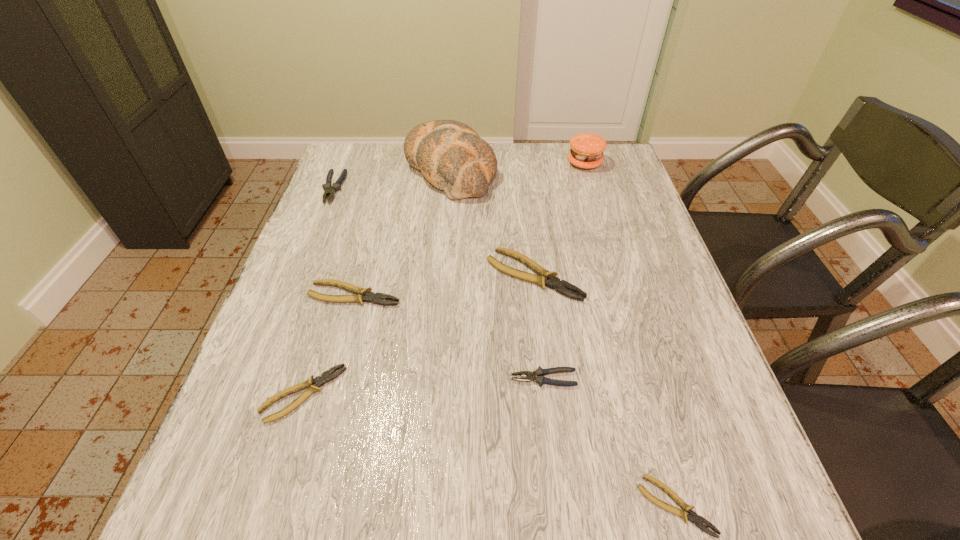
This screenshot has height=540, width=960. I want to click on the smallest yellow pliers, so click(693, 517).

Where is `the shortest object`? the shortest object is located at coordinates (693, 517).

The height and width of the screenshot is (540, 960). What are the coordinates of `vacant space situated on the left of the bread` in the screenshot? It's located at (362, 170).

Locate an element on the screen. vacant space located on the left of the patty is located at coordinates (493, 163).

I want to click on free space located 0.300m at the gripping part of the farther gray pliers, so click(x=296, y=284).

Image resolution: width=960 pixels, height=540 pixels. Identify the location of vacant region located on the left of the biggest yellow pliers. (407, 275).

Locate an element on the screen. Image resolution: width=960 pixels, height=540 pixels. free space located 0.120m on the back of the second biggest yellow pliers is located at coordinates coord(367,247).

Find the location of a particular element. vacant region located 0.340m at the gripping part of the smaller gray pliers is located at coordinates (335, 379).

Where is `free location located 0.370m at the gripping part of the smaller gray pliers`? free location located 0.370m at the gripping part of the smaller gray pliers is located at coordinates (320, 379).

At what (x,y) coordinates should I click in order to perform the action: click on vacant space located 0.130m at the gripping part of the smaller gray pliers. Please return your answer as a coordinate pair (x, y). The image size is (960, 540). Looking at the image, I should click on (444, 379).